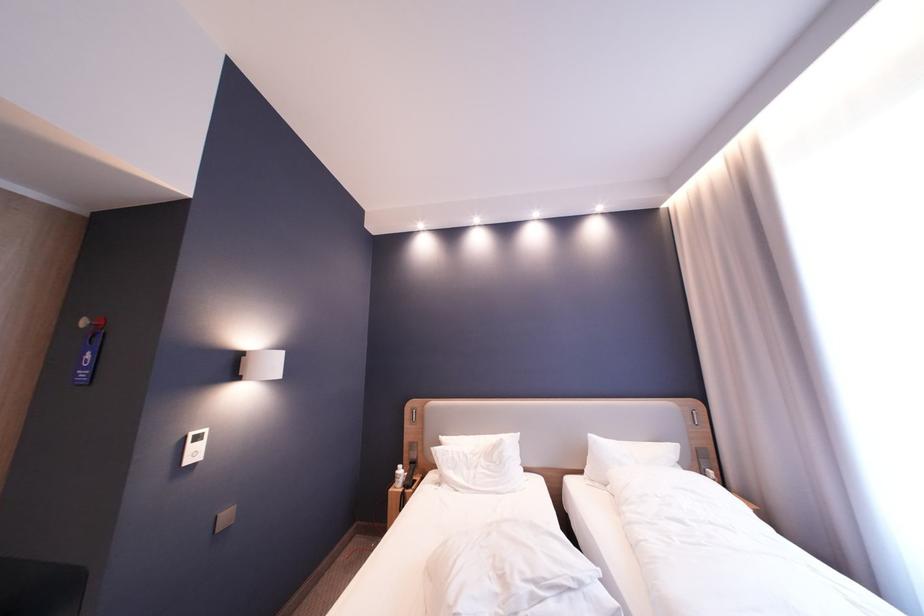
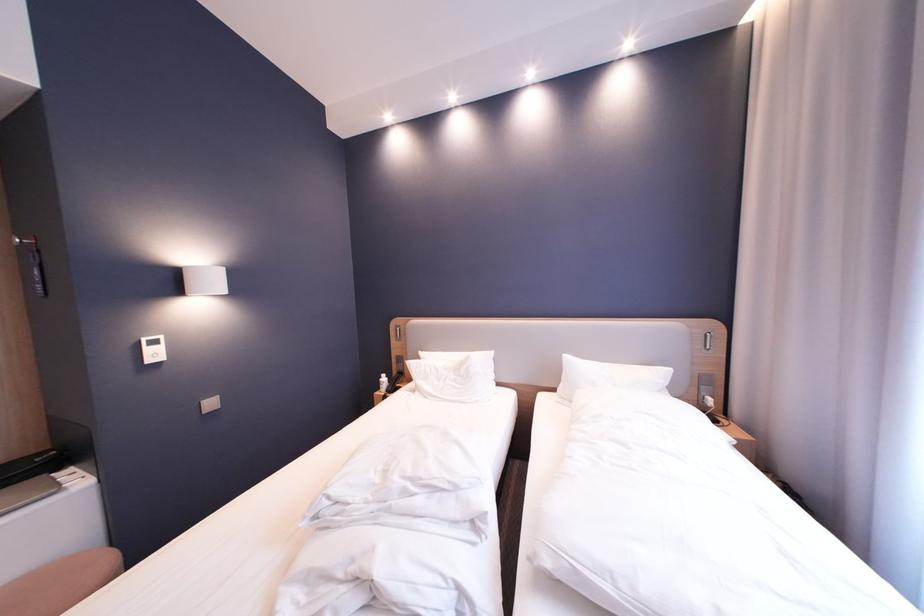
In the second image, find the point that corresponds to the point at 193,437 in the first image.

(148, 341)